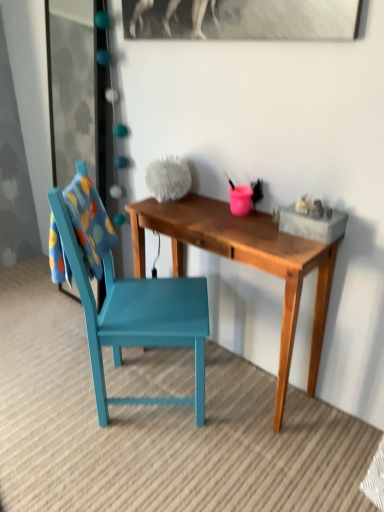
Question: Does point (99, 302) appear closer or farther from the camera than point (129, 293)?

Choices:
 (A) farther
 (B) closer

Answer: (A)

Question: In terms of size, does transparent glass door at upper left appear bigger or smaller than teal painted wood chair at left?

Choices:
 (A) small
 (B) big

Answer: (A)

Question: Estimate the real-world distances between objects in this image. Which object is farther from the wooden desk at center?

Choices:
 (A) teal painted wood chair at left
 (B) transparent glass door at upper left

Answer: (B)

Question: Estimate the real-world distances between objects in this image. Which object is farther from the wooden desk at center?

Choices:
 (A) transparent glass door at upper left
 (B) teal painted wood chair at left

Answer: (A)